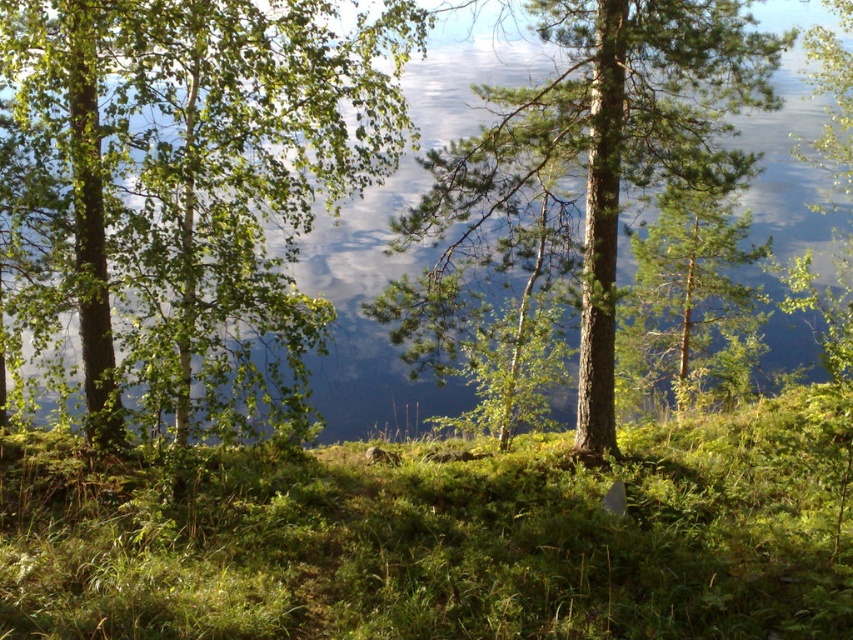
Between green leafy grass at center and green leafy tree at left, which one appears on the left side from the viewer's perspective?

From the viewer's perspective, green leafy tree at left appears more on the left side.

Who is shorter, green leafy grass at center or green leafy tree at left?

With less height is green leafy tree at left.

Is point (68, 525) closer to viewer compared to point (216, 349)?

Yes.

Image resolution: width=853 pixels, height=640 pixels. What are the coordinates of `green leafy grass at center` in the screenshot? It's located at (442, 536).

Is green leafy tree at left shorter than green rough bark tree at center?

Correct, green leafy tree at left is not as tall as green rough bark tree at center.

Is point (370, 40) more distant than point (380, 321)?

That is True.

The image size is (853, 640). I want to click on green leafy tree at left, so pos(189,193).

Which is in front, point (711, 468) or point (460, 186)?

Point (460, 186) is more forward.

Does green leafy grass at center appear over green rough bark tree at center?

No.

Find the location of a particular element. The width and height of the screenshot is (853, 640). green leafy grass at center is located at coordinates (442, 536).

Identify the location of green leafy grass at center. (442, 536).